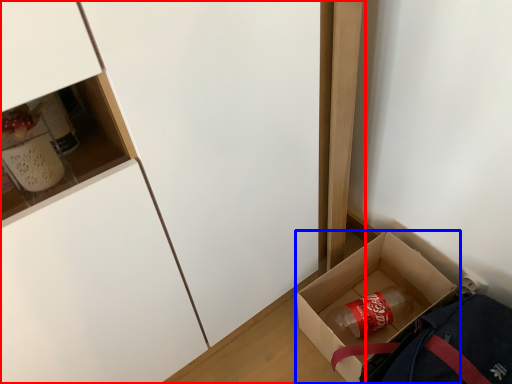
Question: Which object appears closest to the camera in this image, cabinetry (highlighted by a red box) or box (highlighted by a blue box)?

Choices:
 (A) cabinetry
 (B) box

Answer: (A)